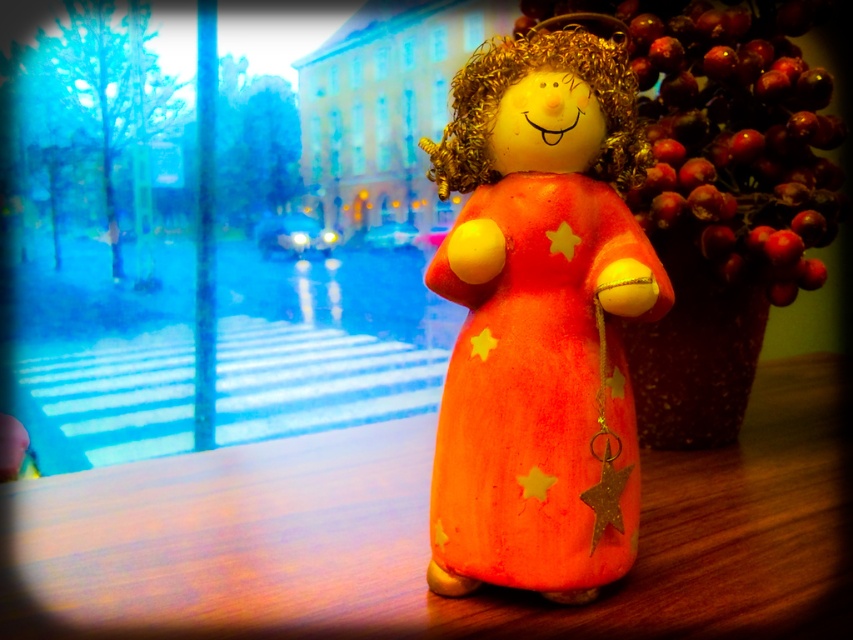
Question: Observing the image, what is the correct spatial positioning of orange felt table at center in reference to shiny red berries at right?

Choices:
 (A) right
 (B) left

Answer: (B)

Question: Which of the following is the closest to the observer?

Choices:
 (A) (595, 384)
 (B) (711, 451)
 (C) (683, 45)

Answer: (A)

Question: Is orange felt table at center below shiny red berries at right?

Choices:
 (A) yes
 (B) no

Answer: (A)

Question: Which object is positioned closest to the shiny red berries at right?

Choices:
 (A) orange felt dress at center
 (B) orange felt table at center

Answer: (A)

Question: Which object is closer to the camera taking this photo?

Choices:
 (A) shiny red berries at right
 (B) orange felt dress at center

Answer: (B)

Question: Is orange felt dress at center bigger than shiny red berries at right?

Choices:
 (A) yes
 (B) no

Answer: (B)